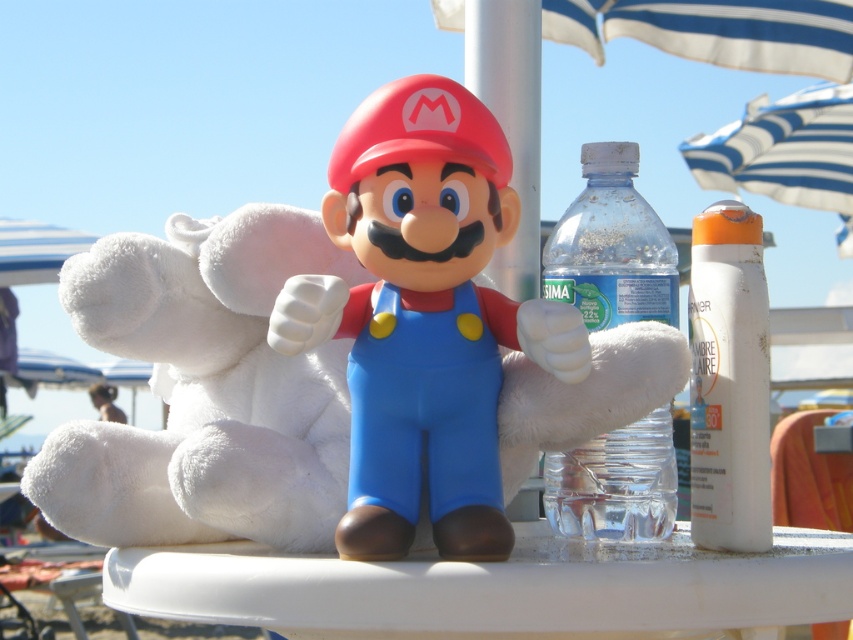
You are planning to place a new object at coordinate point 0.5, 0.5. Is there enough space to place it there without overlapping with the matte plastic mario at center?

The matte plastic mario at center is located at point (424,317), which is very close to the desired coordinate of (426,320). Depending on the size of the new object, there might be an overlap. However, since the exact size of Mario and the new object aren

You are a photographer setting up for a photo shoot. You need to position a matte plastic mario at center and a transparent plastic bottle at center so that both are in focus. Since the camera can only focus on one plane, which object should you focus on to ensure both are sharp?

You should focus on the matte plastic mario at center because it is closer to the viewer than the transparent plastic bottle at center. By focusing on the closer object, the depth of field may extend to include the farther object, increasing the chances of both being in focus.

You are a photographer setting up a shot of Mario. You want to focus on the transparent plastic bottle at center without the white plastic table at center blocking it. Can you adjust your camera angle to achieve this?

The white plastic table at center is closer to the viewer than the transparent plastic bottle at center. To avoid the table blocking the bottle, you can lower your camera angle so that the bottle appears above the table.